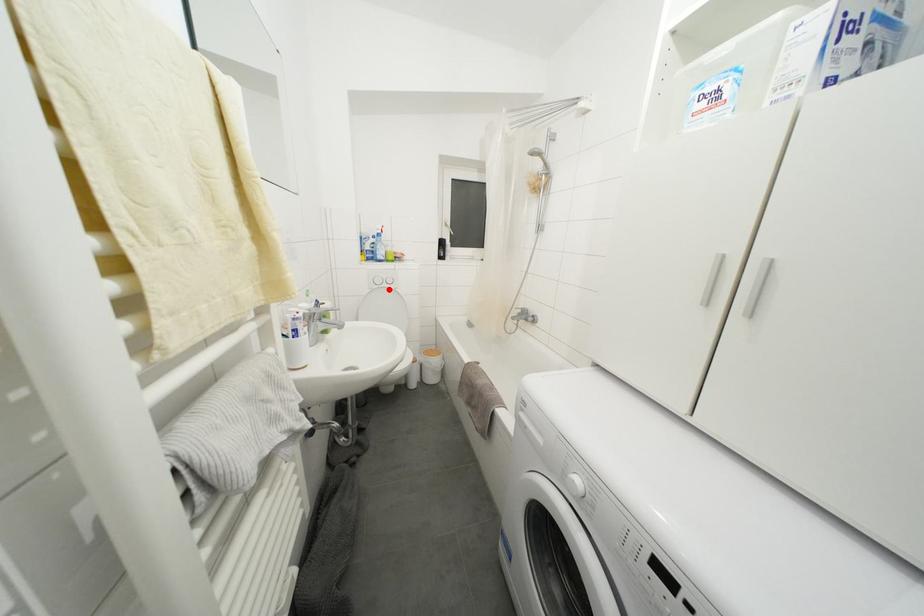
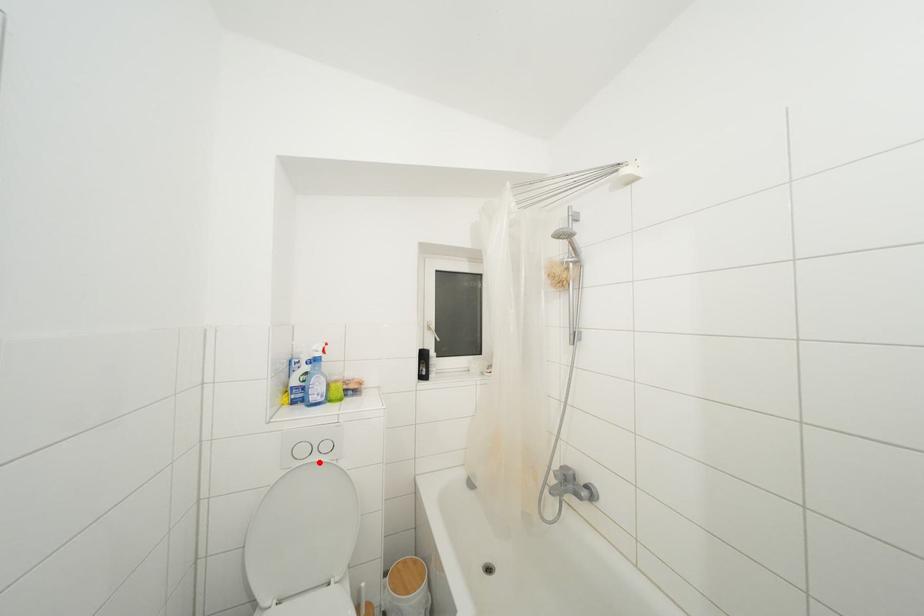
I am providing you with two images of the same scene from different viewpoints. A red point is marked on the first image and another point is marked on the second image. Is the red point in image1 aligned with the point shown in image2?

Yes